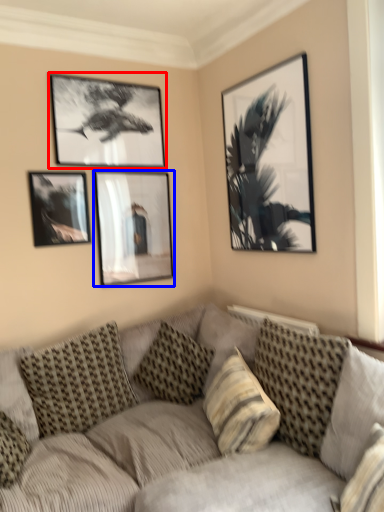
Question: Which of the following is the closest to the observer, picture frame (highlighted by a red box) or picture frame (highlighted by a blue box)?

Choices:
 (A) picture frame
 (B) picture frame

Answer: (A)